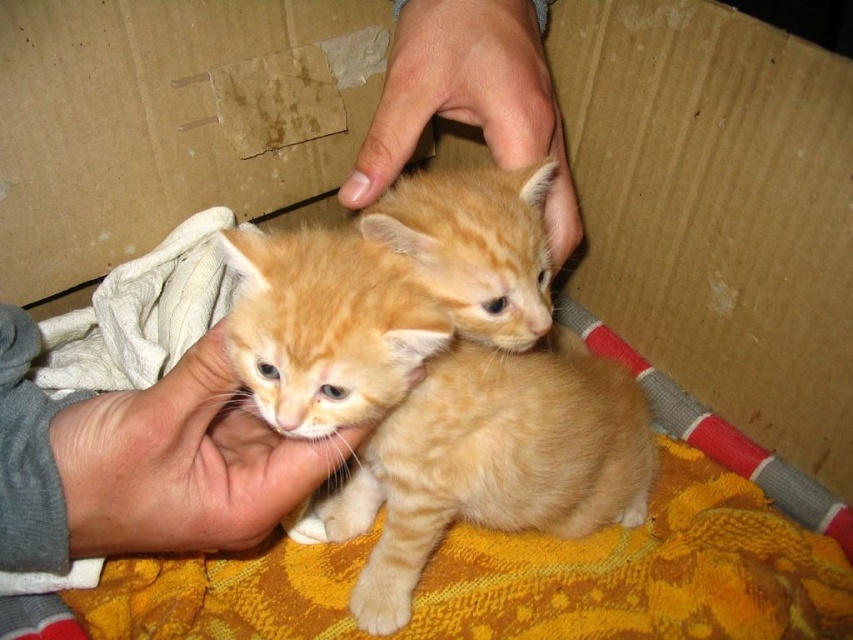
Question: Which object is farther from the camera taking this photo?

Choices:
 (A) smooth skin hand at upper center
 (B) orange fur kittens at center
 (C) flesh-toned skin at center

Answer: (A)

Question: Is orange fur kittens at center wider than smooth skin hand at upper center?

Choices:
 (A) no
 (B) yes

Answer: (B)

Question: Which is farther from the orange fur kittens at center?

Choices:
 (A) flesh-toned skin at center
 (B) smooth skin hand at upper center

Answer: (B)

Question: Which point is farther to the camera?

Choices:
 (A) orange fur kittens at center
 (B) smooth skin hand at upper center

Answer: (B)

Question: Is orange fur kittens at center smaller than smooth skin hand at upper center?

Choices:
 (A) yes
 (B) no

Answer: (B)

Question: Is the position of orange tabby kitten at center more distant than that of flesh-toned skin at center?

Choices:
 (A) yes
 (B) no

Answer: (B)